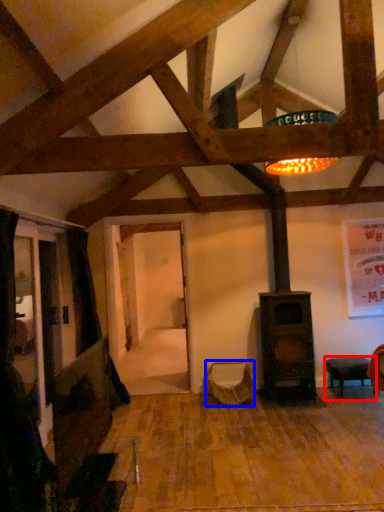
Question: Which object is closer to the camera taking this photo, furniture (highlighted by a red box) or swivel chair (highlighted by a blue box)?

Choices:
 (A) furniture
 (B) swivel chair

Answer: (A)